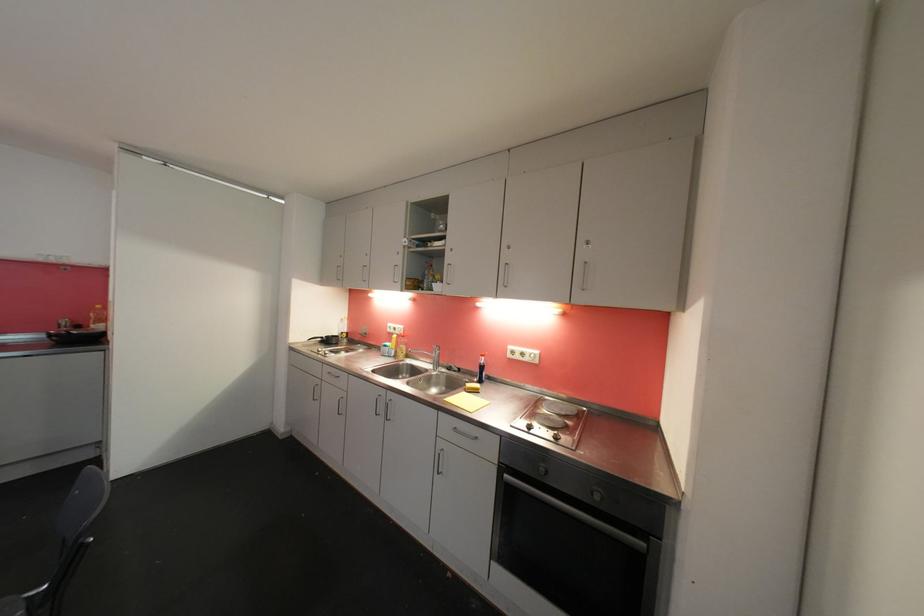
Where would you turn the oven knob? Please return your answer as a coordinate pair (x, y).

(597, 496)